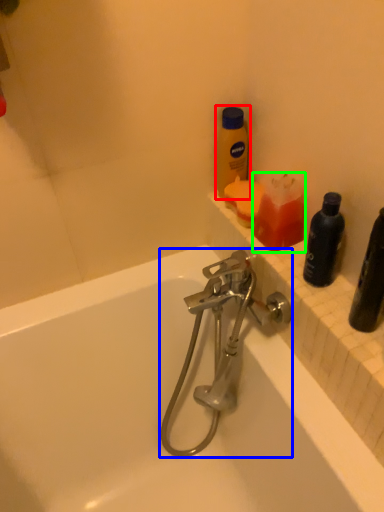
Question: Estimate the real-world distances between objects in this image. Which object is closer to bottle (highlighted by a red box), tap (highlighted by a blue box) or cleaning product (highlighted by a green box)?

Choices:
 (A) tap
 (B) cleaning product

Answer: (B)